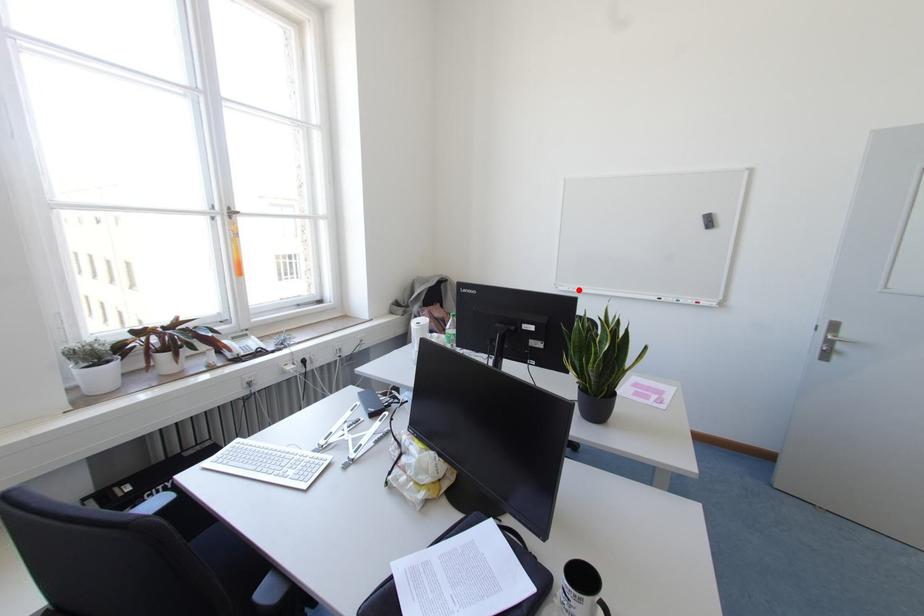
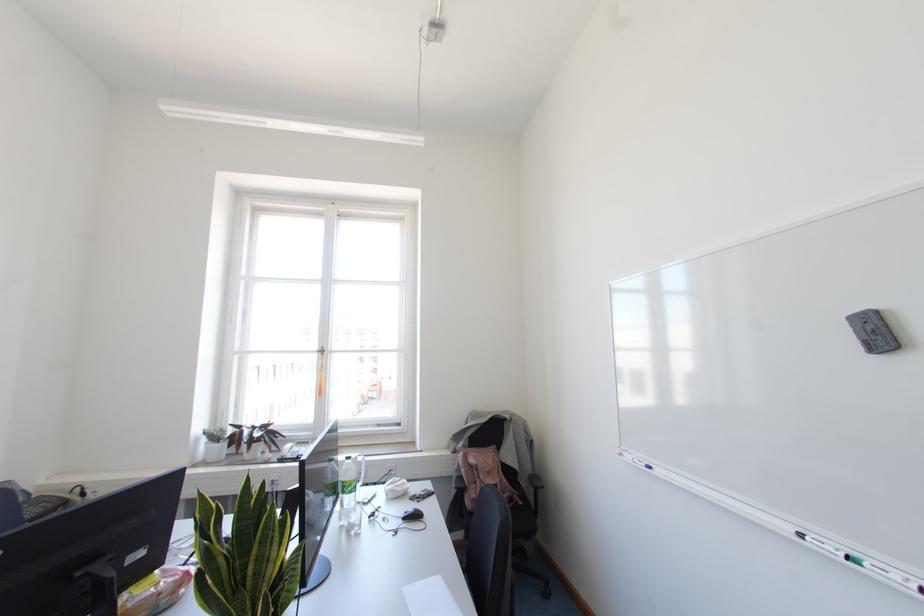
Question: I am providing you with two images of the same scene from different viewpoints. A red point is marked on the first image. Can you still see the location of the red point in image 2?

Choices:
 (A) Yes
 (B) No

Answer: (A)